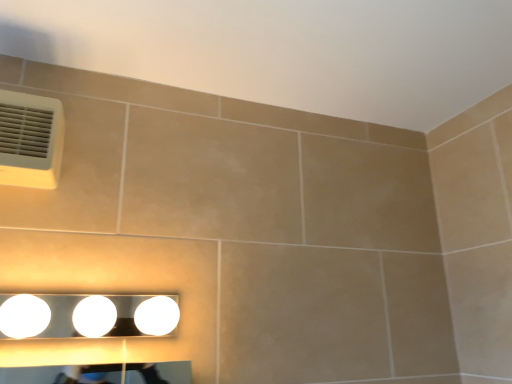
Locate an element on the screen. The width and height of the screenshot is (512, 384). white plastic air conditioning at upper left is located at coordinates coord(30,140).

What do you see at coordinates (30, 140) in the screenshot?
I see `white plastic air conditioning at upper left` at bounding box center [30, 140].

What do you see at coordinates (86, 316) in the screenshot? I see `white glossy light fixture at lower center` at bounding box center [86, 316].

What is the approximate height of white glossy light fixture at lower center?

4.64 inches.

The image size is (512, 384). In order to click on white glossy light fixture at lower center in this screenshot , I will do (86, 316).

In order to face white glossy light fixture at lower center, should I rotate leftwards or rightwards?

Turn left by 20.868 degrees to look at white glossy light fixture at lower center.

What are the coordinates of `white plastic air conditioning at upper left` in the screenshot? It's located at (30, 140).

Which object is positioned more to the left, white glossy light fixture at lower center or white plastic air conditioning at upper left?

Positioned to the left is white plastic air conditioning at upper left.

Relative to white plastic air conditioning at upper left, is white glossy light fixture at lower center in front or behind?

Clearly, white glossy light fixture at lower center is in front of white plastic air conditioning at upper left.

Considering the positions of point (26, 309) and point (24, 122), is point (26, 309) closer or farther from the camera than point (24, 122)?

Clearly, point (26, 309) is closer to the camera than point (24, 122).

From the image's perspective, which one is positioned lower, white glossy light fixture at lower center or white plastic air conditioning at upper left?

white glossy light fixture at lower center is shown below in the image.

From a real-world perspective, is white glossy light fixture at lower center positioned over white plastic air conditioning at upper left based on gravity?

Incorrect, from a real-world perspective, white glossy light fixture at lower center is lower than white plastic air conditioning at upper left.

Considering the relative sizes of white glossy light fixture at lower center and white plastic air conditioning at upper left in the image provided, is white glossy light fixture at lower center wider than white plastic air conditioning at upper left?

Indeed, white glossy light fixture at lower center has a greater width compared to white plastic air conditioning at upper left.

Can you confirm if white glossy light fixture at lower center is taller than white plastic air conditioning at upper left?

No.

Considering the relative sizes of white glossy light fixture at lower center and white plastic air conditioning at upper left in the image provided, is white glossy light fixture at lower center bigger than white plastic air conditioning at upper left?

Correct, white glossy light fixture at lower center is larger in size than white plastic air conditioning at upper left.

Is white plastic air conditioning at upper left located within white glossy light fixture at lower center?

No, white plastic air conditioning at upper left is not inside white glossy light fixture at lower center.

Are white glossy light fixture at lower center and white plastic air conditioning at upper left located far from each other?

No, white glossy light fixture at lower center is in close proximity to white plastic air conditioning at upper left.

Is white glossy light fixture at lower center facing towards white plastic air conditioning at upper left?

No, white glossy light fixture at lower center does not turn towards white plastic air conditioning at upper left.

How distant is white glossy light fixture at lower center from white plastic air conditioning at upper left?

white glossy light fixture at lower center is 11.38 inches from white plastic air conditioning at upper left.

This screenshot has width=512, height=384. What are the coordinates of `air conditioning behind the white glossy light fixture at lower center` in the screenshot? It's located at (30, 140).

Based on the photo, considering the positions of objects white plastic air conditioning at upper left and white glossy light fixture at lower center in the image provided, who is more to the left, white plastic air conditioning at upper left or white glossy light fixture at lower center?

white plastic air conditioning at upper left is more to the left.

Considering the positions of objects white plastic air conditioning at upper left and white glossy light fixture at lower center in the image provided, who is in front, white plastic air conditioning at upper left or white glossy light fixture at lower center?

Positioned in front is white glossy light fixture at lower center.

Which point is more distant from viewer, (19, 184) or (152, 333)?

The point (19, 184) is more distant.

From the image's perspective, between white plastic air conditioning at upper left and white glossy light fixture at lower center, who is located below?

white glossy light fixture at lower center.

From a real-world perspective, between white plastic air conditioning at upper left and white glossy light fixture at lower center, who is vertically higher?

white plastic air conditioning at upper left.

Which object is thinner, white plastic air conditioning at upper left or white glossy light fixture at lower center?

Thinner between the two is white plastic air conditioning at upper left.

Considering the relative sizes of white plastic air conditioning at upper left and white glossy light fixture at lower center in the image provided, is white plastic air conditioning at upper left taller than white glossy light fixture at lower center?

Indeed, white plastic air conditioning at upper left has a greater height compared to white glossy light fixture at lower center.

Is white plastic air conditioning at upper left bigger or smaller than white glossy light fixture at lower center?

white plastic air conditioning at upper left is smaller than white glossy light fixture at lower center.

Is white glossy light fixture at lower center inside white plastic air conditioning at upper left?

That's incorrect, white glossy light fixture at lower center is not inside white plastic air conditioning at upper left.

Are white plastic air conditioning at upper left and white glossy light fixture at lower center making contact?

No, white plastic air conditioning at upper left is not touching white glossy light fixture at lower center.

Is white plastic air conditioning at upper left facing towards white glossy light fixture at lower center?

No, white plastic air conditioning at upper left is not oriented towards white glossy light fixture at lower center.

Identify the location of fixture lying in front of the white plastic air conditioning at upper left. The height and width of the screenshot is (384, 512). (86, 316).

Locate an element on the screen. The height and width of the screenshot is (384, 512). air conditioning located above the white glossy light fixture at lower center (from the image's perspective) is located at coordinates (30, 140).

What are the coordinates of `fixture that is on the right side of white plastic air conditioning at upper left` in the screenshot? It's located at (x=86, y=316).